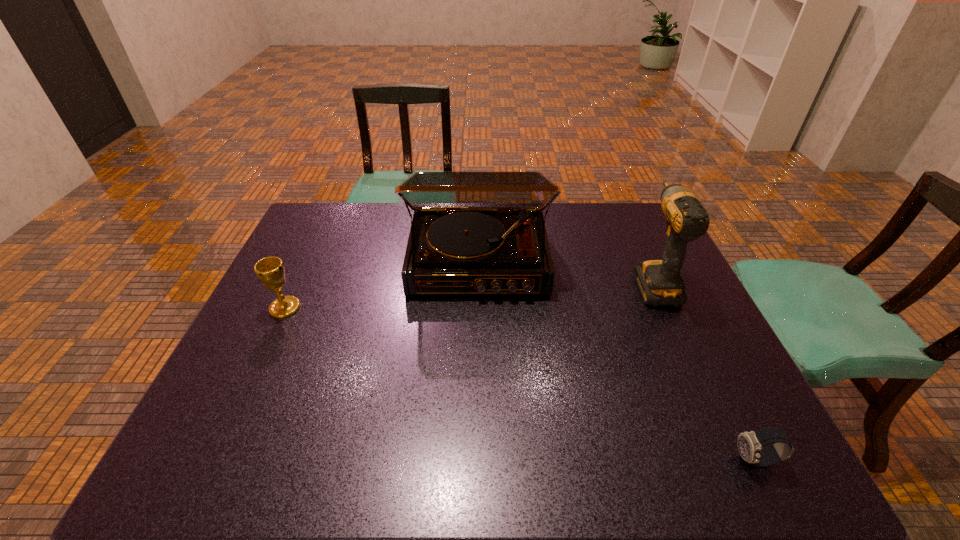
In the image, there is a desktop. Find the location of `vacant space at the far edge`. vacant space at the far edge is located at coordinates (607, 223).

Find the location of `blank area at the near edge`. blank area at the near edge is located at coordinates (482, 452).

In the image, there is a desktop. Identify the location of free space at the left edge. This screenshot has height=540, width=960. (318, 273).

In the image, there is a desktop. Where is `vacant space at the right edge`? vacant space at the right edge is located at coordinates (699, 367).

Locate an element on the screen. vacant space at the far left corner of the desktop is located at coordinates (348, 229).

Where is `free space at the near left corner of the desktop`? free space at the near left corner of the desktop is located at coordinates (219, 448).

Find the location of a particular element. The image size is (960, 540). free location at the far right corner of the desktop is located at coordinates (630, 224).

Find the location of a particular element. The height and width of the screenshot is (540, 960). vacant area between the nearest object and the third object from right to left is located at coordinates (617, 361).

This screenshot has width=960, height=540. In order to click on free space between the record player and the nearest object in this screenshot , I will do `click(617, 361)`.

Where is `vacant area that lies between the drill and the record player`? vacant area that lies between the drill and the record player is located at coordinates (565, 272).